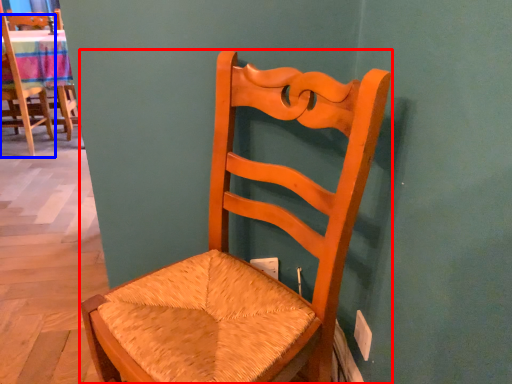
Question: Which point is further to the camera, chair (highlighted by a red box) or chair (highlighted by a blue box)?

Choices:
 (A) chair
 (B) chair

Answer: (B)